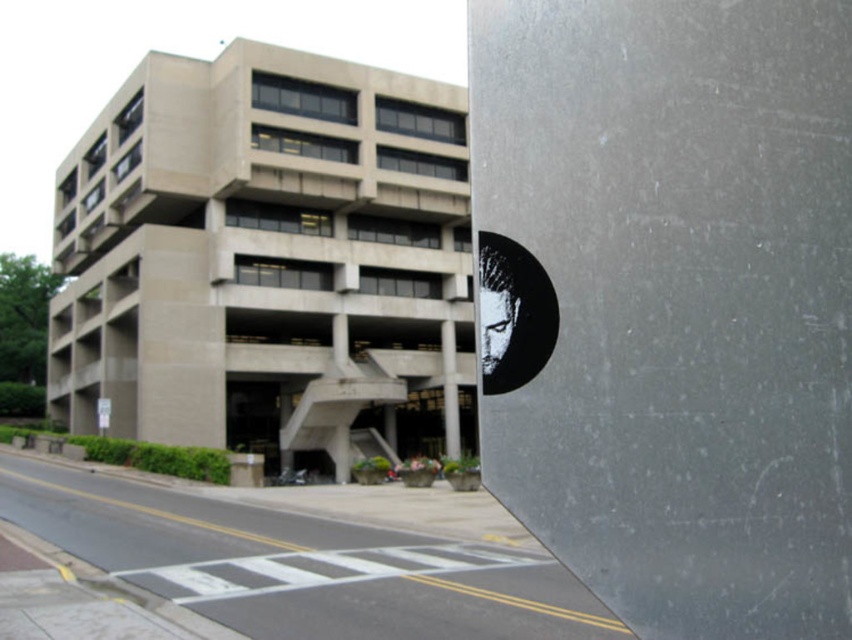
Question: Is black glossy sticker at upper right wider than white plastic sign at lower left?

Choices:
 (A) yes
 (B) no

Answer: (B)

Question: In this image, where is black glossy sticker at upper right located relative to white plastic sign at lower left?

Choices:
 (A) above
 (B) below

Answer: (A)

Question: Considering the real-world distances, which object is closest to the white plastic sign at lower left?

Choices:
 (A) black glossy sticker at upper right
 (B) smooth concrete pole at center

Answer: (B)

Question: Is black glossy sticker at upper right above white plastic sign at lower left?

Choices:
 (A) yes
 (B) no

Answer: (A)

Question: Which is nearer to the white plastic sign at lower left?

Choices:
 (A) black glossy sticker at upper right
 (B) smooth concrete pole at center

Answer: (B)

Question: Among these points, which one is nearest to the camera?

Choices:
 (A) (96, 410)
 (B) (450, 429)
 (C) (545, 288)

Answer: (C)